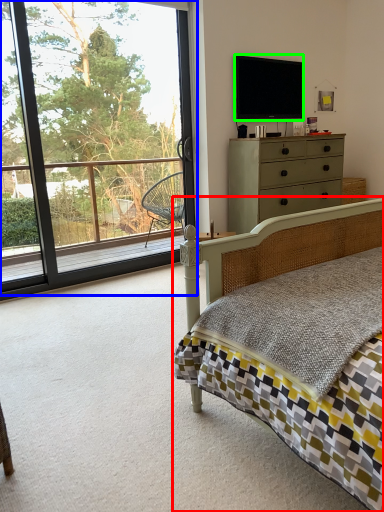
Question: Estimate the real-world distances between objects in this image. Which object is closer to bed (highlighted by a red box), window (highlighted by a blue box) or television (highlighted by a green box)?

Choices:
 (A) window
 (B) television

Answer: (B)